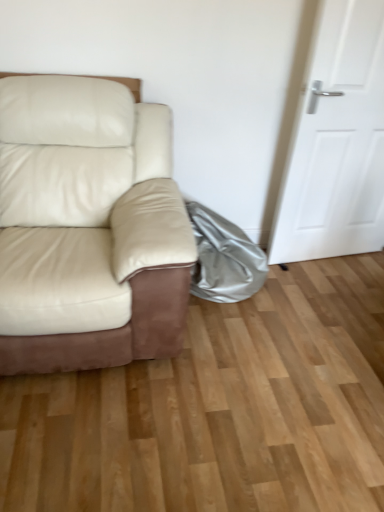
This screenshot has width=384, height=512. Describe the element at coordinates (336, 141) in the screenshot. I see `white matte door at right` at that location.

This screenshot has width=384, height=512. Find the location of `white matte door at right`. white matte door at right is located at coordinates (336, 141).

The image size is (384, 512). Describe the element at coordinates (88, 227) in the screenshot. I see `matte cream leather couch at left` at that location.

Where is `matte cream leather couch at left`? This screenshot has height=512, width=384. matte cream leather couch at left is located at coordinates (88, 227).

This screenshot has height=512, width=384. I want to click on white matte door at right, so click(x=336, y=141).

Who is bigger, matte cream leather couch at left or white matte door at right?

Bigger between the two is matte cream leather couch at left.

Measure the distance from matte cream leather couch at left to white matte door at right.

They are 1.08 meters apart.

From a real-world perspective, is matte cream leather couch at left located higher than white matte door at right?

Incorrect, from a real-world perspective, matte cream leather couch at left is lower than white matte door at right.

Is point (219, 233) in front of point (324, 19)?

No, (219, 233) is further to viewer.

I want to click on door located in front of the shiny metallic bag at lower right, so click(336, 141).

Considering the relative sizes of shiny metallic bag at lower right and white matte door at right in the image provided, is shiny metallic bag at lower right thinner than white matte door at right?

In fact, shiny metallic bag at lower right might be wider than white matte door at right.

How far apart are shiny metallic bag at lower right and white matte door at right?

shiny metallic bag at lower right is 22.30 inches from white matte door at right.

Is white matte door at right not near shiny metallic bag at lower right?

white matte door at right is actually quite close to shiny metallic bag at lower right.

Does white matte door at right turn towards shiny metallic bag at lower right?

No.

Considering the positions of objects white matte door at right and shiny metallic bag at lower right in the image provided, who is behind, white matte door at right or shiny metallic bag at lower right?

shiny metallic bag at lower right is behind.

From the image's perspective, is white matte door at right under shiny metallic bag at lower right?

No, from the image's perspective, white matte door at right is not below shiny metallic bag at lower right.

Could shiny metallic bag at lower right be considered to be inside matte cream leather couch at left?

No, matte cream leather couch at left does not contain shiny metallic bag at lower right.

Is matte cream leather couch at left positioned behind shiny metallic bag at lower right?

No, it is not.

Is matte cream leather couch at left oriented towards shiny metallic bag at lower right?

No, matte cream leather couch at left is not aimed at shiny metallic bag at lower right.

Considering the relative sizes of matte cream leather couch at left and shiny metallic bag at lower right in the image provided, is matte cream leather couch at left shorter than shiny metallic bag at lower right?

No, matte cream leather couch at left is not shorter than shiny metallic bag at lower right.

Considering the positions of objects shiny metallic bag at lower right and matte cream leather couch at left in the image provided, who is in front, shiny metallic bag at lower right or matte cream leather couch at left?

matte cream leather couch at left is in front.

From a real-world perspective, is shiny metallic bag at lower right on top of matte cream leather couch at left?

No, from a real-world perspective, shiny metallic bag at lower right is not over matte cream leather couch at left

In the image, there is a shiny metallic bag at lower right. What are the coordinates of `studio couch above it (from the image's perspective)` in the screenshot? It's located at (88, 227).

How distant is white matte door at right from matte cream leather couch at left?

A distance of 3.53 feet exists between white matte door at right and matte cream leather couch at left.

From the image's perspective, is white matte door at right below matte cream leather couch at left?

No, from the image's perspective, white matte door at right is not below matte cream leather couch at left.

Considering the sizes of objects white matte door at right and matte cream leather couch at left in the image provided, who is taller, white matte door at right or matte cream leather couch at left?

With more height is white matte door at right.

Is white matte door at right placed right next to matte cream leather couch at left?

No, white matte door at right is not next to matte cream leather couch at left.

I want to click on door that appears on the right of matte cream leather couch at left, so click(336, 141).

Where is `door positioned vertically above the shiny metallic bag at lower right (from a real-world perspective)`? door positioned vertically above the shiny metallic bag at lower right (from a real-world perspective) is located at coordinates (336, 141).

Looking at the image, which one is located further to white matte door at right, shiny metallic bag at lower right or matte cream leather couch at left?

matte cream leather couch at left is positioned further to the anchor white matte door at right.

Based on the photo, based on their spatial positions, is white matte door at right or matte cream leather couch at left further from shiny metallic bag at lower right?

matte cream leather couch at left.

Considering their positions, is matte cream leather couch at left positioned further to shiny metallic bag at lower right than white matte door at right?

matte cream leather couch at left.

Looking at the image, which one is located further to matte cream leather couch at left, white matte door at right or shiny metallic bag at lower right?

white matte door at right.

When comparing their distances from white matte door at right, does matte cream leather couch at left or shiny metallic bag at lower right seem further?

The object further to white matte door at right is matte cream leather couch at left.

Estimate the real-world distances between objects in this image. Which object is further from matte cream leather couch at left, shiny metallic bag at lower right or white matte door at right?

The object further to matte cream leather couch at left is white matte door at right.

At what (x,y) coordinates should I click in order to perform the action: click on material located between matte cream leather couch at left and white matte door at right in the left-right direction. Please return your answer as a coordinate pair (x, y). Looking at the image, I should click on (224, 258).